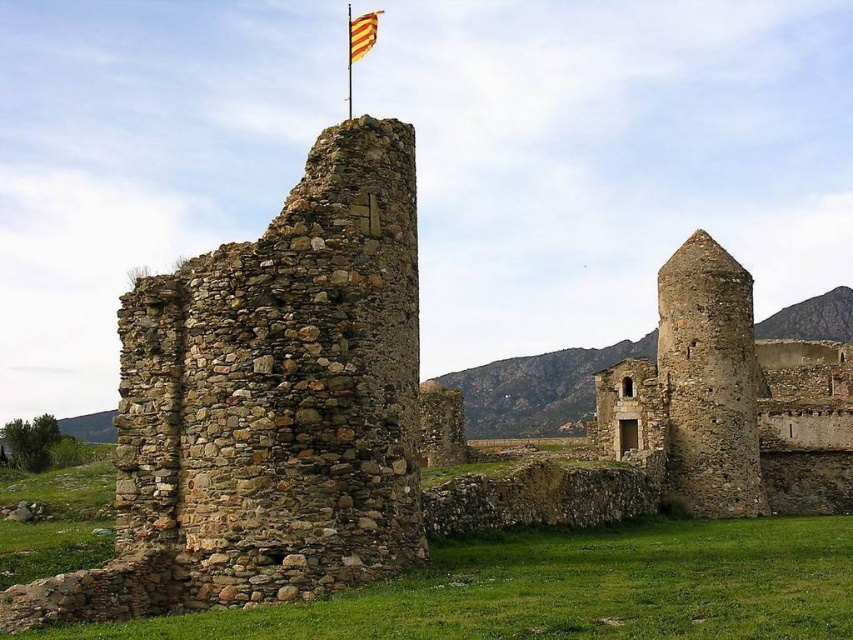
Does point (695, 326) come closer to viewer compared to point (364, 19)?

Yes, it is in front of point (364, 19).

Measure the distance from stone tower at right to yellow striped fabric at top.

stone tower at right is 63.87 meters from yellow striped fabric at top.

Who is more distant from viewer, (x=775, y=435) or (x=349, y=44)?

The point (x=349, y=44) is behind.

This screenshot has height=640, width=853. In order to click on stone tower at right in this screenshot , I will do `click(730, 401)`.